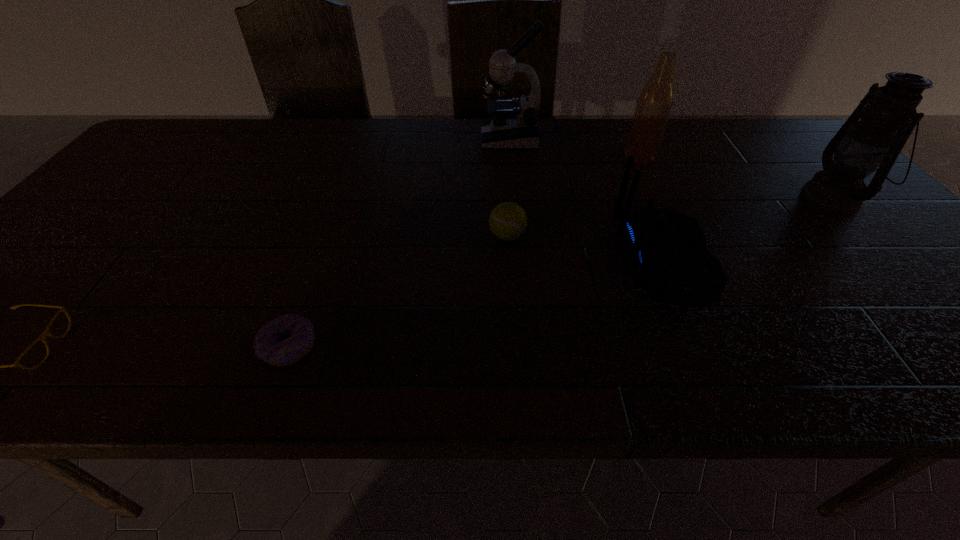
Where is `microscope`? Image resolution: width=960 pixels, height=540 pixels. microscope is located at coordinates (515, 125).

Find the location of a particular element. The width and height of the screenshot is (960, 540). the rightmost object is located at coordinates (888, 114).

This screenshot has height=540, width=960. I want to click on beer bottle, so click(656, 99).

Identify the location of router. (666, 250).

Find the location of `the third shortest object`. the third shortest object is located at coordinates (507, 221).

Find the location of a particular element. Image resolution: width=960 pixels, height=540 pixels. doughnut is located at coordinates (271, 345).

Find the location of a particular element. Image resolution: width=960 pixels, height=540 pixels. vacant space located on the right of the microscope is located at coordinates (629, 139).

Where is `vacant region located on the left of the oil lamp`? This screenshot has width=960, height=540. vacant region located on the left of the oil lamp is located at coordinates (662, 198).

Locate an element on the screen. The width and height of the screenshot is (960, 540). vacant space located on the left of the beer bottle is located at coordinates (532, 157).

Locate an element on the screen. The height and width of the screenshot is (540, 960). free location located on the back of the fourth tallest object is located at coordinates (579, 260).